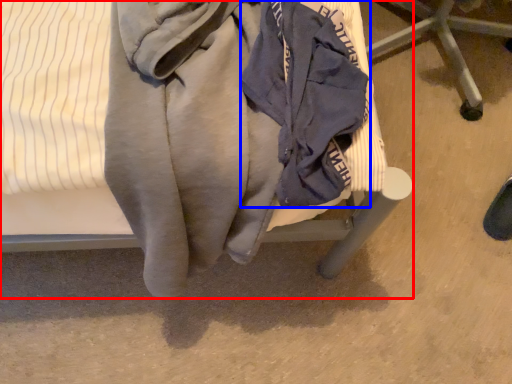
Question: Which object appears farthest to the camera in this image, furniture (highlighted by a red box) or garment (highlighted by a blue box)?

Choices:
 (A) furniture
 (B) garment

Answer: (B)